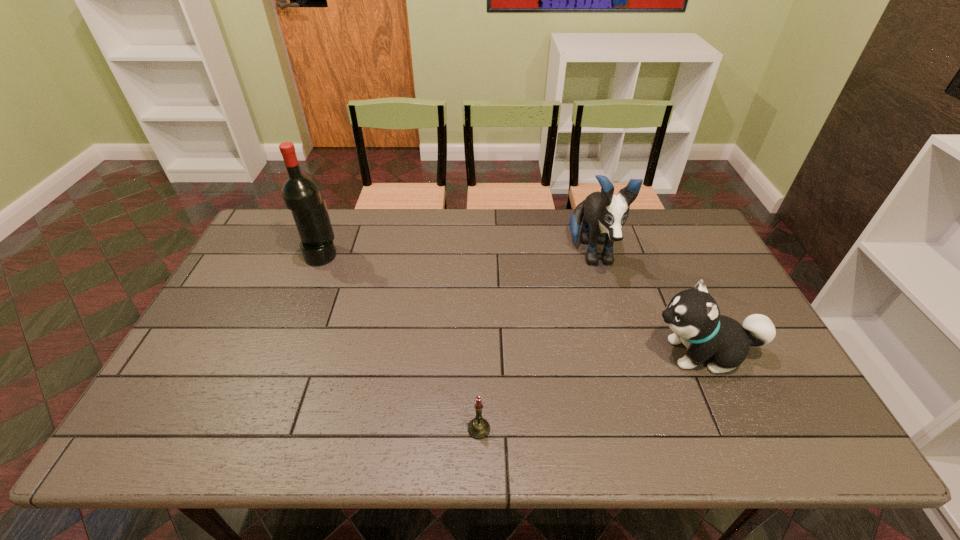
Locate an element on the screen. The width and height of the screenshot is (960, 540). vacant region located 0.130m at the face of the shorter puppy is located at coordinates (597, 353).

You are a GUI agent. You are given a task and a screenshot of the screen. Output one action in this format:
    pyautogui.click(x=<x>, y=<y>)
    Task: Click on the vacant region located at the face of the shorter puppy
    
    Given the screenshot: What is the action you would take?
    pyautogui.click(x=554, y=353)

What are the coordinates of `free space located on the right of the shortest object` in the screenshot? It's located at (588, 429).

Locate an element on the screen. wine bottle present at the far edge is located at coordinates (301, 195).

At what (x,y) coordinates should I click in order to perform the action: click on puppy situated at the far edge. Please return your answer as a coordinate pair (x, y). Looking at the image, I should click on click(605, 214).

Identify the location of object that is at the near edge. pos(478,428).

You are a GUI agent. You are given a task and a screenshot of the screen. Output one action in this format:
    pyautogui.click(x=<x>, y=<y>)
    Task: Click on the object that is at the right edge
    
    Given the screenshot: What is the action you would take?
    pyautogui.click(x=693, y=315)

Identify the location of free space at the far edge of the desktop. Image resolution: width=960 pixels, height=540 pixels. (384, 214).

Find the location of a particular element. The width and height of the screenshot is (960, 540). blank space at the near edge of the desktop is located at coordinates (535, 438).

At what (x,y) coordinates should I click in order to perform the action: click on vacant space at the left edge. Please return your answer as a coordinate pair (x, y). Looking at the image, I should click on (151, 412).